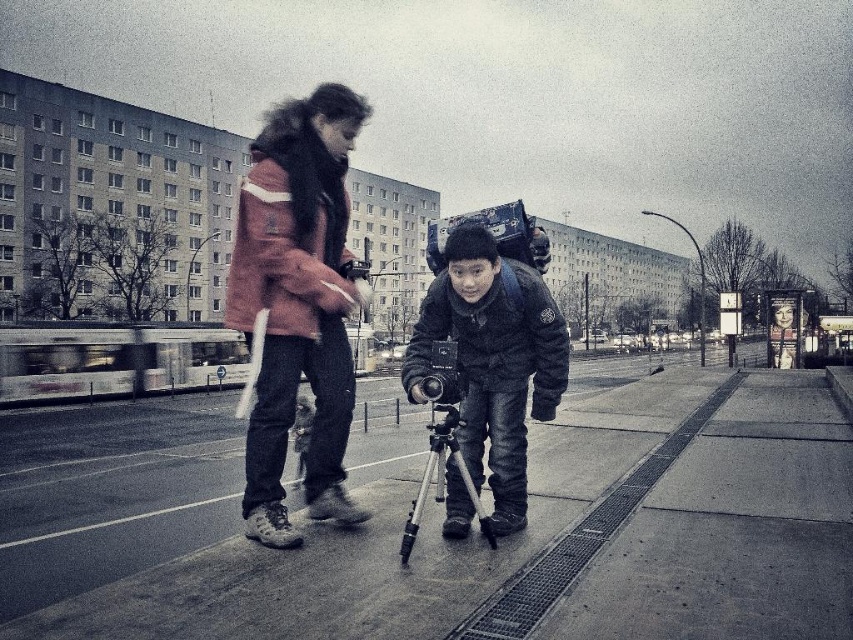
Question: Is matte pink jacket at center below silver metallic tripod at center?

Choices:
 (A) no
 (B) yes

Answer: (A)

Question: Which object is farther from the camera taking this photo?

Choices:
 (A) matte pink jacket at center
 (B) silver metallic tripod at center
 (C) matte black camera at center

Answer: (C)

Question: Among these objects, which one is farthest from the camera?

Choices:
 (A) matte black camera at center
 (B) smooth concrete pavement at center

Answer: (A)

Question: Is matte pink jacket at center behind silver metallic tripod at center?

Choices:
 (A) yes
 (B) no

Answer: (A)

Question: Does matte black camera at center have a lesser width compared to silver metallic tripod at center?

Choices:
 (A) yes
 (B) no

Answer: (B)

Question: Which object is positioned closest to the silver metallic tripod at center?

Choices:
 (A) smooth concrete pavement at center
 (B) matte pink jacket at center

Answer: (B)